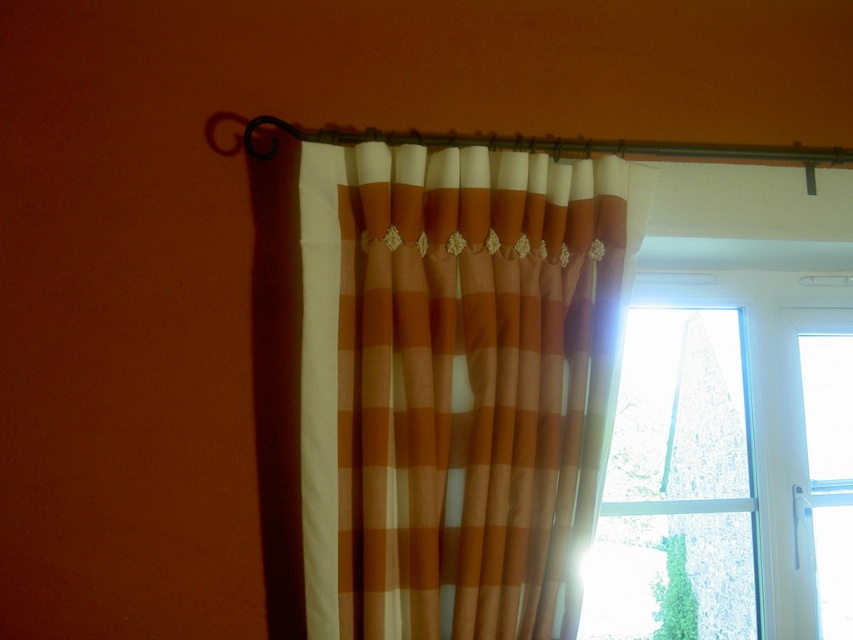
You are a window cleaner who needs to clean the transparent glass window at right. The orange and white checkered curtain at center is blocking your view. Can you move the curtain to access the window?

The orange and white checkered curtain at center is located above the transparent glass window at right, so you can move the curtain down to access the window for cleaning.

You are standing in a room and want to take a photo of the orange and white checkered curtain at center. If your camera is 4.67 feet away from the curtain, will you be able to capture the entire curtain in the photo?

The orange and white checkered curtain at center and camera are 4.67 feet apart from each other. Whether you can capture the entire curtain depends on the camera lens and sensor size, but the distance alone doesn

You are a window installer and need to replace the transparent glass window at right. The new window requires a 20 inch clearance between the orange and white checkered curtain at center and the window frame. Is the current distance sufficient?

The orange and white checkered curtain at center is currently 18.90 inches from the transparent glass window at right. Since the required clearance is 20 inches, the current distance of 18.90 inches is insufficient. The curtain will need to be moved further away or a different window installation plan must be considered.